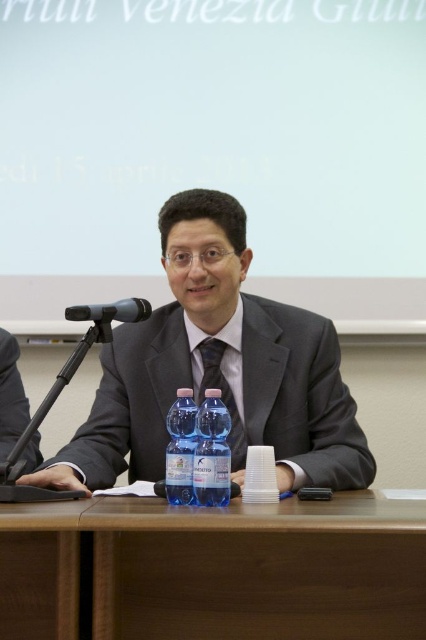
Question: Does brown wooden table at center have a greater width compared to black plastic microphone at left?

Choices:
 (A) no
 (B) yes

Answer: (B)

Question: Can you confirm if transparent plastic bottle at center is thinner than black plastic microphone at left?

Choices:
 (A) no
 (B) yes

Answer: (B)

Question: Is matte gray suit at center smaller than transparent plastic bottle at center?

Choices:
 (A) no
 (B) yes

Answer: (A)

Question: Among these objects, which one is nearest to the camera?

Choices:
 (A) black plastic microphone at left
 (B) matte gray suit at center
 (C) brown wooden table at center

Answer: (C)

Question: Which point is closer to the camera?

Choices:
 (A) (215, 193)
 (B) (69, 314)
 (C) (204, 410)

Answer: (C)

Question: Based on their relative distances, which object is nearer to the matte gray suit at center?

Choices:
 (A) clear plastic bottle at center
 (B) black plastic microphone at left

Answer: (B)